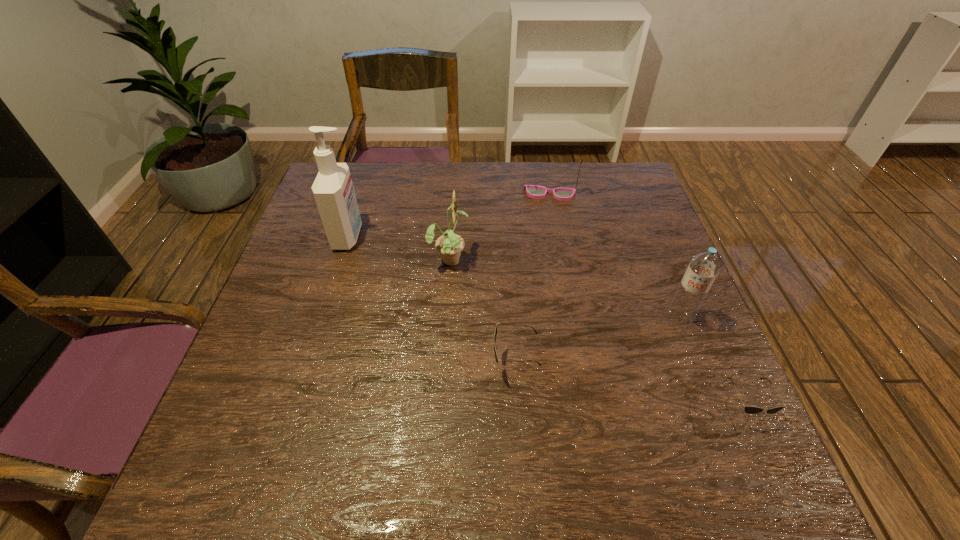
Please point a spot to add another sunglasses on the left. Please provide its 2D coordinates. Your answer should be formatted as a tuple, i.e. [(x, y)], where the tuple contains the x and y coordinates of a point satisfying the conditions above.

[(318, 326)]